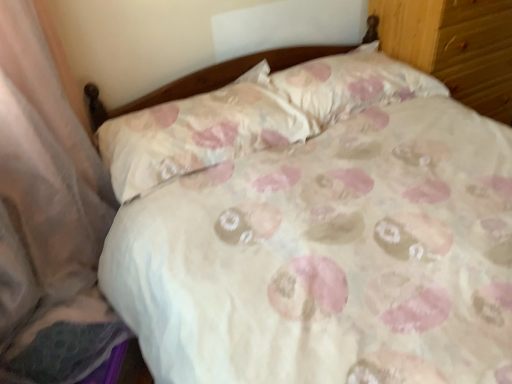
Question: Is floral fabric pillow at upper center, the 2th pillow in the left-to-right sequence, smaller than white fabric pillow at center, the 2th pillow in the right-to-left sequence?

Choices:
 (A) no
 (B) yes

Answer: (A)

Question: Is floral fabric pillow at upper center, the 2th pillow in the left-to-right sequence, in front of white fabric pillow at center, the 2th pillow in the right-to-left sequence?

Choices:
 (A) no
 (B) yes

Answer: (A)

Question: Can you confirm if floral fabric pillow at upper center, the 2th pillow in the left-to-right sequence, is shorter than white fabric pillow at center, the 2th pillow in the right-to-left sequence?

Choices:
 (A) no
 (B) yes

Answer: (A)

Question: Can you confirm if floral fabric pillow at upper center, the 2th pillow in the left-to-right sequence, is bigger than white fabric pillow at center, the 2th pillow in the right-to-left sequence?

Choices:
 (A) no
 (B) yes

Answer: (B)

Question: From a real-world perspective, is floral fabric pillow at upper center, placed as the first pillow when sorted from right to left, located beneath white fabric pillow at center, the 2th pillow in the right-to-left sequence?

Choices:
 (A) no
 (B) yes

Answer: (B)

Question: Considering the positions of floral fabric pillow at upper center, placed as the first pillow when sorted from right to left, and wooden dresser at upper right in the image, is floral fabric pillow at upper center, placed as the first pillow when sorted from right to left, bigger or smaller than wooden dresser at upper right?

Choices:
 (A) big
 (B) small

Answer: (B)

Question: From a real-world perspective, is floral fabric pillow at upper center, the 2th pillow in the left-to-right sequence, above or below wooden dresser at upper right?

Choices:
 (A) below
 (B) above

Answer: (B)

Question: Is floral fabric pillow at upper center, the 2th pillow in the left-to-right sequence, spatially inside wooden dresser at upper right, or outside of it?

Choices:
 (A) outside
 (B) inside

Answer: (A)

Question: Is floral fabric pillow at upper center, the 2th pillow in the left-to-right sequence, taller or shorter than wooden dresser at upper right?

Choices:
 (A) tall
 (B) short

Answer: (B)

Question: In terms of size, does white fabric pillow at center, which is counted as the 1th pillow, starting from the left, appear bigger or smaller than floral fabric pillow at upper center, placed as the first pillow when sorted from right to left?

Choices:
 (A) big
 (B) small

Answer: (B)

Question: In terms of width, does white fabric pillow at center, the 2th pillow in the right-to-left sequence, look wider or thinner when compared to floral fabric pillow at upper center, the 2th pillow in the left-to-right sequence?

Choices:
 (A) wide
 (B) thin

Answer: (B)

Question: Is point (215, 125) positioned closer to the camera than point (358, 46)?

Choices:
 (A) closer
 (B) farther

Answer: (A)

Question: Considering their positions, is white fabric pillow at center, which is counted as the 1th pillow, starting from the left, located in front of or behind floral fabric pillow at upper center, the 2th pillow in the left-to-right sequence?

Choices:
 (A) behind
 (B) front

Answer: (B)

Question: Is wooden dresser at upper right taller or shorter than white fabric pillow at center, which is counted as the 1th pillow, starting from the left?

Choices:
 (A) short
 (B) tall

Answer: (B)

Question: Is wooden dresser at upper right wider or thinner than white fabric pillow at center, which is counted as the 1th pillow, starting from the left?

Choices:
 (A) wide
 (B) thin

Answer: (A)